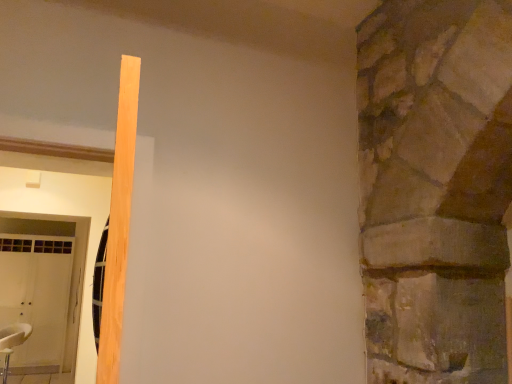
Question: From a real-world perspective, relative to white leather chair at lower left, is light wood beam at left vertically above or below?

Choices:
 (A) below
 (B) above

Answer: (B)

Question: Is point (109, 322) positioned closer to the camera than point (20, 337)?

Choices:
 (A) closer
 (B) farther

Answer: (A)

Question: In terms of height, does light wood beam at left look taller or shorter compared to white leather chair at lower left?

Choices:
 (A) tall
 (B) short

Answer: (B)

Question: In terms of height, does white leather chair at lower left look taller or shorter compared to light wood beam at left?

Choices:
 (A) short
 (B) tall

Answer: (B)

Question: In terms of width, does white leather chair at lower left look wider or thinner when compared to light wood beam at left?

Choices:
 (A) thin
 (B) wide

Answer: (B)

Question: From a real-world perspective, relative to light wood beam at left, is white leather chair at lower left vertically above or below?

Choices:
 (A) above
 (B) below

Answer: (B)

Question: Choose the correct answer: Is white leather chair at lower left inside light wood beam at left or outside it?

Choices:
 (A) inside
 (B) outside

Answer: (B)